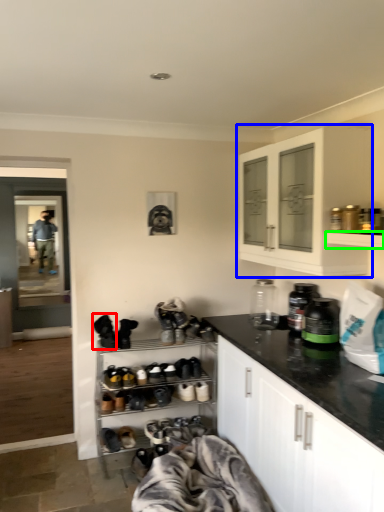
Question: Which is farther away from shoe (highlighted by a red box)? cabinetry (highlighted by a blue box) or shelf (highlighted by a green box)?

Choices:
 (A) cabinetry
 (B) shelf

Answer: (B)